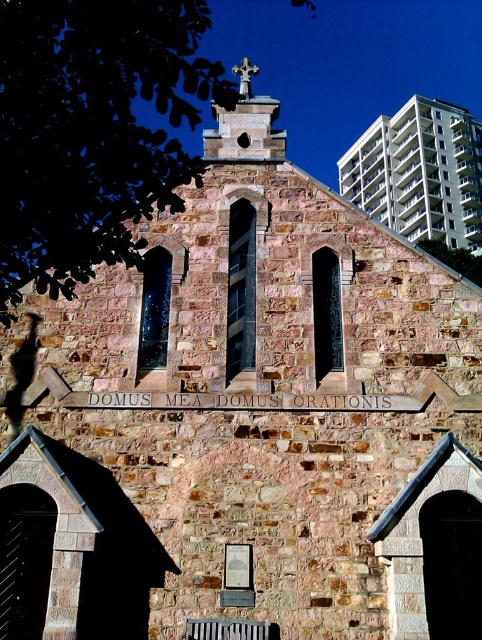
Question: In this image, where is white concrete building at upper right located relative to wooden slats at lower center?

Choices:
 (A) right
 (B) left

Answer: (A)

Question: Which point is closer to the camera taking this photo?

Choices:
 (A) (232, 72)
 (B) (469, 225)
 (C) (185, 637)

Answer: (C)

Question: Which object is positioned closest to the white concrete building at upper right?

Choices:
 (A) smooth stone spire at upper center
 (B) wooden slats at lower center

Answer: (A)

Question: Where is white concrete building at upper right located in relation to wooden slats at lower center in the image?

Choices:
 (A) below
 (B) above

Answer: (B)

Question: Is smooth stone spire at upper center smaller than wooden slats at lower center?

Choices:
 (A) no
 (B) yes

Answer: (A)

Question: Which of these objects is positioned farthest from the white concrete building at upper right?

Choices:
 (A) wooden slats at lower center
 (B) smooth stone spire at upper center

Answer: (A)